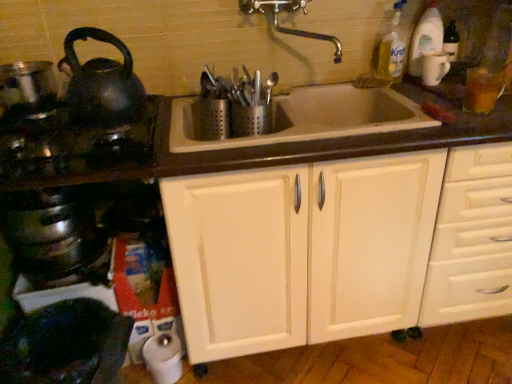
Locate an element on the screen. Image resolution: width=512 pixels, height=384 pixels. free spot in front of white glossy mug at upper right is located at coordinates (436, 92).